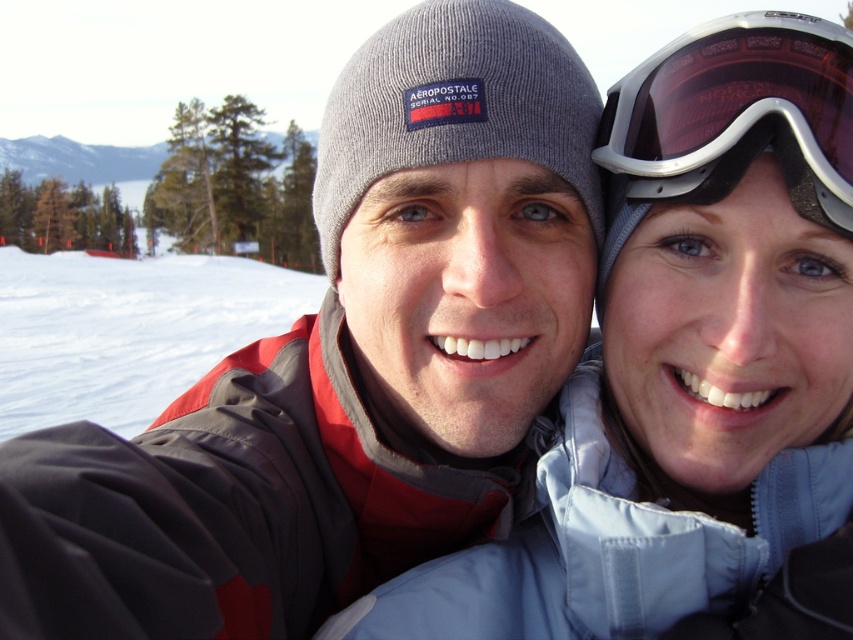
Question: Observing the image, what is the correct spatial positioning of white powder snow at lower left in reference to matte black goggles at upper right?

Choices:
 (A) above
 (B) below

Answer: (A)

Question: Is white powder snow at lower left to the left of matte black goggles at upper right from the viewer's perspective?

Choices:
 (A) yes
 (B) no

Answer: (A)

Question: From the image, what is the correct spatial relationship of white powder snow at lower left in relation to matte black goggles at upper right?

Choices:
 (A) below
 (B) above

Answer: (B)

Question: Which point is closer to the camera taking this photo?

Choices:
 (A) (131, 355)
 (B) (843, 134)

Answer: (B)